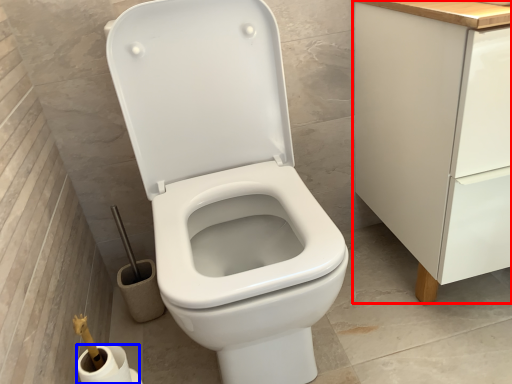
Question: Which point is further to the camera, cabinetry (highlighted by a red box) or toilet paper (highlighted by a blue box)?

Choices:
 (A) cabinetry
 (B) toilet paper

Answer: (B)